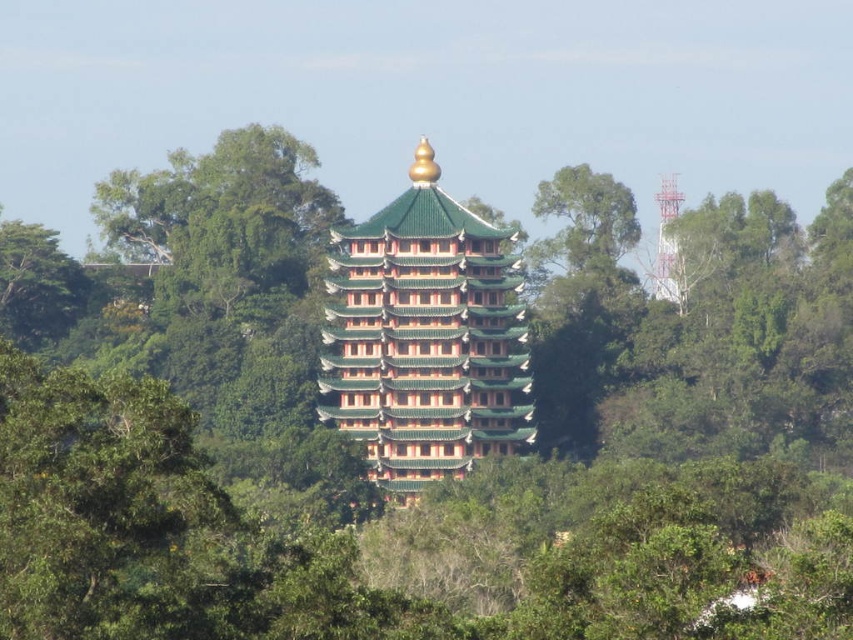
You are standing in front of the pagoda and want to take a photo of the green glazed tiles at center and the green leafy tree at upper center. Which object should you focus on first to ensure both are in the frame?

You should focus on the green glazed tiles at center first because it is closer to the viewer than the green leafy tree at upper center, allowing both to be in the frame by adjusting the camera angle accordingly.

You are an architect designing a new garden layout. You need to place a decorative fountain between the green glazed tiles at center and the green leafy tree at upper center. Based on their widths, which side should the fountain be placed closer to?

The green glazed tiles at center might be wider than green leafy tree at upper center, so the fountain should be placed closer to the green leafy tree at upper center to ensure proper spacing.